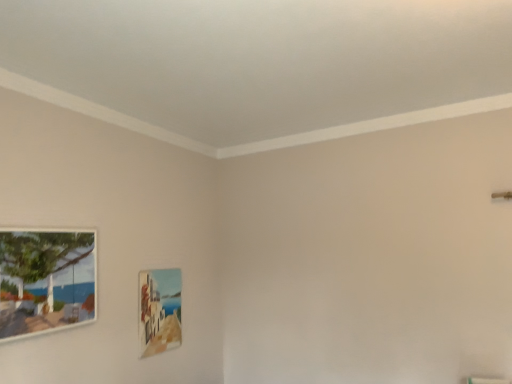
Question: Is point (77, 274) positioned closer to the camera than point (180, 279)?

Choices:
 (A) closer
 (B) farther

Answer: (A)

Question: In terms of size, does wooden picture frame at left, the 1th picture frame positioned from the front, appear bigger or smaller than matte wooden picture frame at lower center, the first picture frame positioned from the right?

Choices:
 (A) small
 (B) big

Answer: (B)

Question: Would you say wooden picture frame at left, the 1th picture frame positioned from the front, is inside or outside matte wooden picture frame at lower center, the first picture frame positioned from the right?

Choices:
 (A) outside
 (B) inside

Answer: (A)

Question: From their relative heights in the image, would you say matte wooden picture frame at lower center, arranged as the second picture frame when viewed from the front, is taller or shorter than wooden picture frame at left, acting as the second picture frame starting from the back?

Choices:
 (A) tall
 (B) short

Answer: (A)

Question: Based on their sizes in the image, would you say matte wooden picture frame at lower center, the first picture frame positioned from the right, is bigger or smaller than wooden picture frame at left, the first picture frame when ordered from left to right?

Choices:
 (A) small
 (B) big

Answer: (A)

Question: From a real-world perspective, is matte wooden picture frame at lower center, arranged as the second picture frame when viewed from the front, physically located above or below wooden picture frame at left, the 1th picture frame positioned from the front?

Choices:
 (A) below
 (B) above

Answer: (A)

Question: From the image's perspective, is matte wooden picture frame at lower center, the first picture frame positioned from the right, located above or below wooden picture frame at left, acting as the second picture frame starting from the back?

Choices:
 (A) below
 (B) above

Answer: (A)